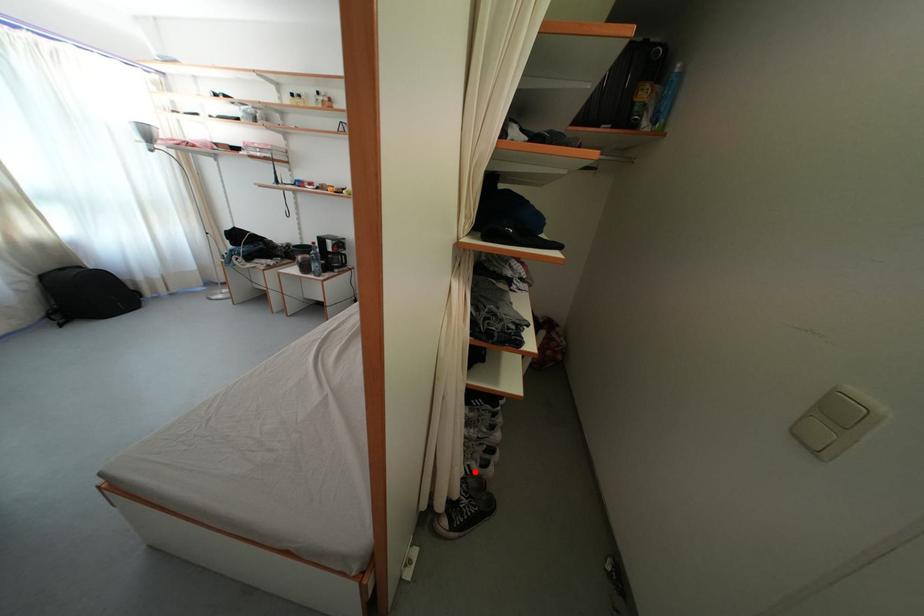
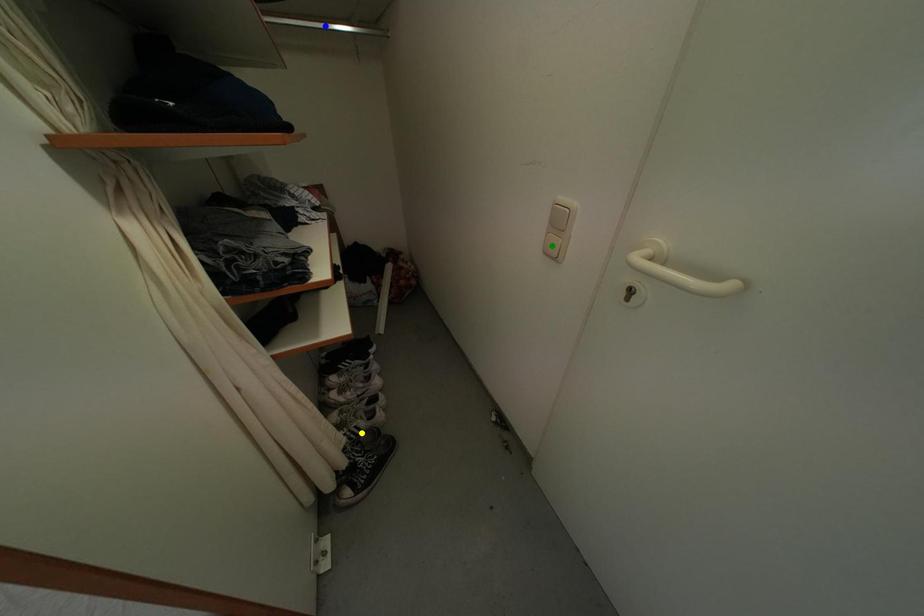
Question: I am providing you with two images of the same scene from different viewpoints. A red point is marked on the first image. You are given multiple points on the second image. Which point in image 2 is actually the same real-world point as the red point in image 1?

Choices:
 (A) green point
 (B) yellow point
 (C) blue point

Answer: (B)